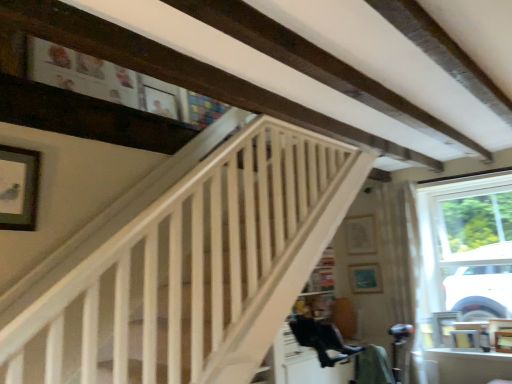
Question: Does point (349, 230) appear closer or farther from the camera than point (359, 281)?

Choices:
 (A) farther
 (B) closer

Answer: (A)

Question: In terms of height, does matte white picture frame at upper center, which is the first picture frame in back-to-front order, look taller or shorter compared to matte blue picture frame at center, which appears as the 3th picture frame when viewed from the front?

Choices:
 (A) tall
 (B) short

Answer: (A)

Question: Considering the real-world distances, which object is closest to the wooden picture frame at lower right, which is the fourth picture frame in left-to-right order?

Choices:
 (A) matte blue picture frame at center, which appears as the 3th picture frame when viewed from the front
 (B) matte white picture frame at upper center, arranged as the 2th picture frame when viewed from the left
 (C) white wooden stairwell at upper center
 (D) matte black picture frame at upper left, which appears as the fourth picture frame when viewed from the back
 (E) sheer white curtain at right

Answer: (E)

Question: Considering the real-world distances, which object is closest to the sheer white curtain at right?

Choices:
 (A) matte black picture frame at upper left, which appears as the fourth picture frame when viewed from the back
 (B) wooden picture frame at lower right, which ranks as the 1th picture frame in right-to-left order
 (C) matte blue picture frame at center, which is counted as the 2th picture frame, starting from the right
 (D) matte white picture frame at upper center, the third picture frame from the bottom
 (E) white wooden stairwell at upper center

Answer: (C)